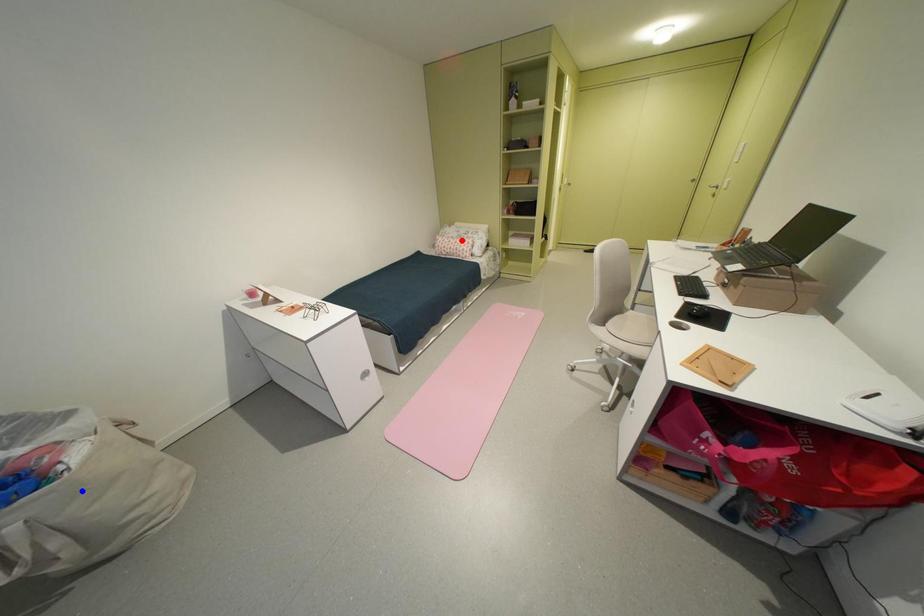
Question: In the image, two points are highlighted. Which point is nearer to the camera? Reply with the corresponding letter.

Choices:
 (A) blue point
 (B) red point

Answer: (A)